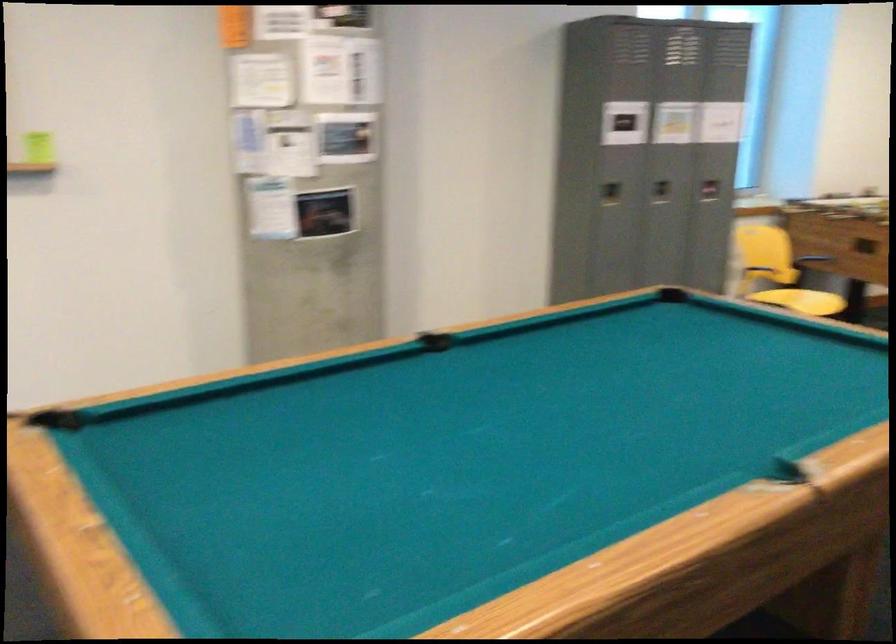
Find where to pull the foosball table handle. Please return your answer as a coordinate pair (x, y).

(788, 473)